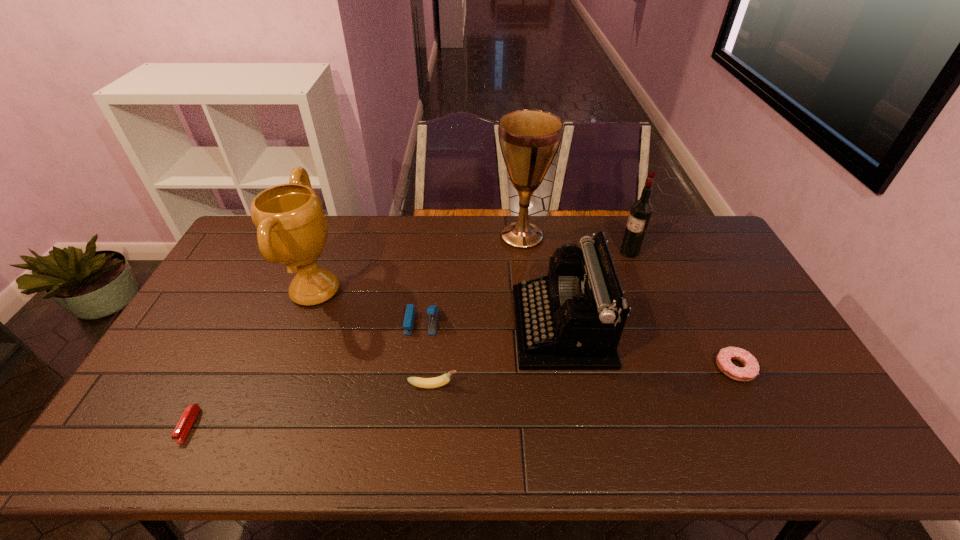
At what (x,y) coordinates should I click in order to perform the action: click on the tallest object. Please return your answer as a coordinate pair (x, y). This screenshot has height=540, width=960. Looking at the image, I should click on (529, 139).

Locate an element on the screen. the seventh object from right to left is located at coordinates tap(291, 226).

The height and width of the screenshot is (540, 960). I want to click on the sixth shortest object, so click(x=640, y=213).

What are the coordinates of `wine bottle` in the screenshot? It's located at (640, 213).

Find the location of a particular element. The height and width of the screenshot is (540, 960). typewriter is located at coordinates (571, 319).

Where is `the right stapler`? The width and height of the screenshot is (960, 540). the right stapler is located at coordinates (432, 309).

I want to click on the farther stapler, so click(432, 309).

I want to click on the sixth tallest object, so click(442, 380).

Where is `the rightmost object`? This screenshot has height=540, width=960. the rightmost object is located at coordinates (750, 370).

Locate an element on the screen. The height and width of the screenshot is (540, 960). the nearer stapler is located at coordinates (189, 415).